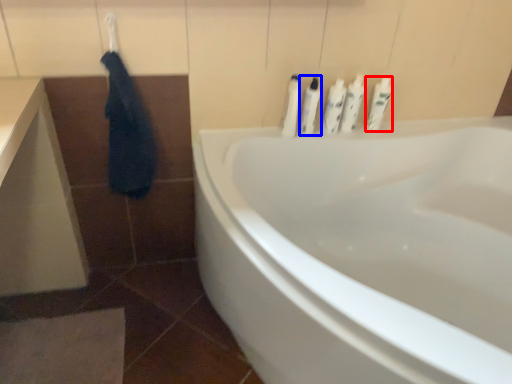
Question: Among these objects, which one is farthest to the camera, toiletry (highlighted by a red box) or toiletry (highlighted by a blue box)?

Choices:
 (A) toiletry
 (B) toiletry

Answer: (A)